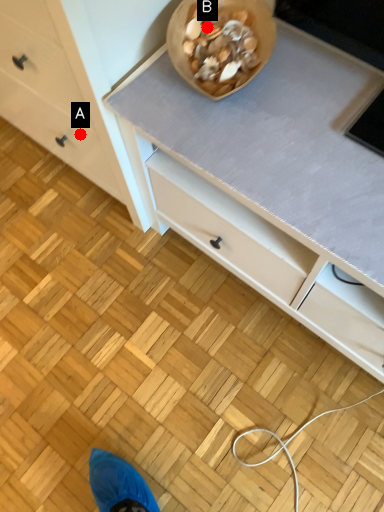
Question: Two points are circled on the image, labeled by A and B beside each circle. Which point is farther from the camera taking this photo?

Choices:
 (A) A is further
 (B) B is further

Answer: (A)